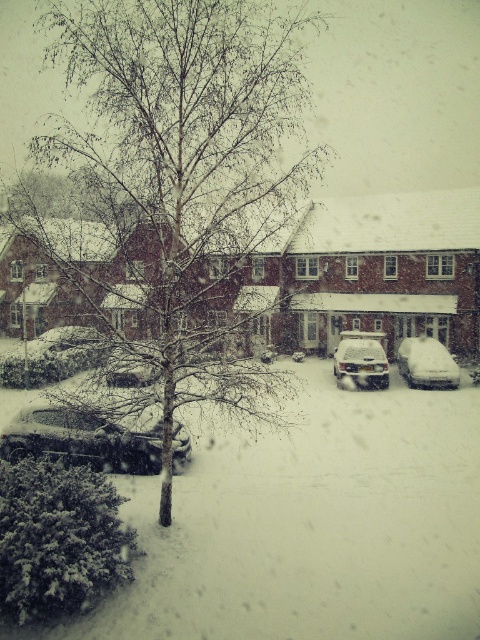
Question: Which object is positioned farthest from the sleek silver sedan at center?

Choices:
 (A) white fluffy snow at center
 (B) bare branches at center
 (C) snow-covered car at center

Answer: (B)

Question: Considering the relative positions of white fluffy snow at center and snow-covered car at center in the image provided, where is white fluffy snow at center located with respect to snow-covered car at center?

Choices:
 (A) right
 (B) left

Answer: (B)

Question: Can you confirm if white fluffy snow at center is bigger than sleek silver sedan at center?

Choices:
 (A) no
 (B) yes

Answer: (B)

Question: Does shiny silver car at lower left have a smaller size compared to snow-covered car at center?

Choices:
 (A) yes
 (B) no

Answer: (B)

Question: Which point appears farthest from the camera in this image?

Choices:
 (A) (349, 412)
 (B) (358, 369)
 (C) (153, 369)
 (D) (442, 348)

Answer: (D)

Question: Among these points, which one is farthest from the camera?

Choices:
 (A) (347, 356)
 (B) (85, 426)
 (C) (441, 369)
 (D) (126, 368)

Answer: (A)